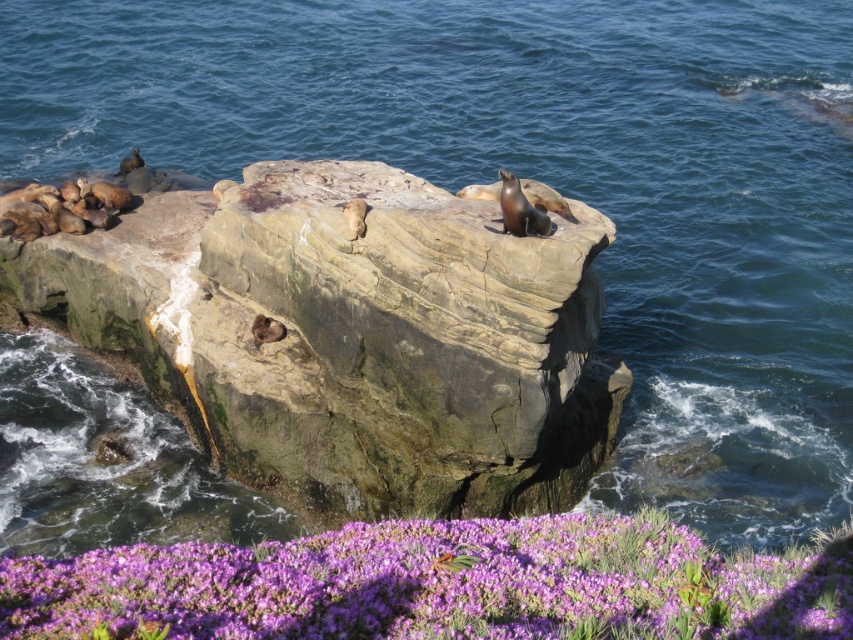
Question: Can you confirm if smooth rock at center is smaller than purple matte flowers at lower center?

Choices:
 (A) yes
 (B) no

Answer: (B)

Question: Is smooth rock at center bigger than purple matte flowers at lower center?

Choices:
 (A) no
 (B) yes

Answer: (B)

Question: Can you confirm if smooth rock at center is positioned below purple matte flowers at lower center?

Choices:
 (A) yes
 (B) no

Answer: (B)

Question: Which of the following is the closest to the observer?

Choices:
 (A) (379, 420)
 (B) (172, 596)

Answer: (B)